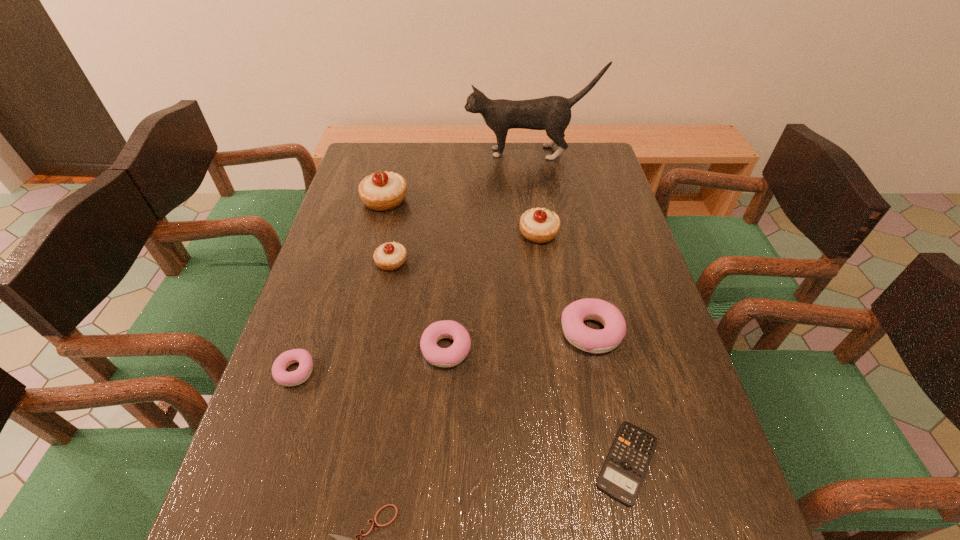
Identify the location of vacant space that satisfies the following two spatial constraints: 1. on the front side of the second shortest object; 2. on the left side of the biggest beige pastry. The image size is (960, 540). (320, 462).

Locate an element on the screen. This screenshot has height=540, width=960. vacant area that satisfies the following two spatial constraints: 1. on the front side of the sixth nearest object; 2. on the left side of the fifth tallest object is located at coordinates (377, 332).